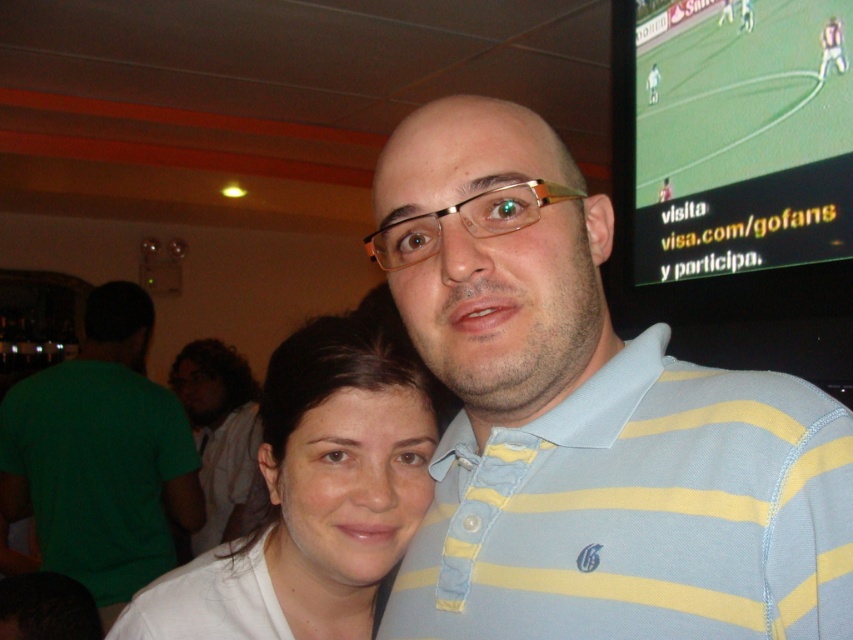
Question: Can you confirm if green cotton shirt at left is wider than light brown hair at center?

Choices:
 (A) no
 (B) yes

Answer: (B)

Question: Estimate the real-world distances between objects in this image. Which object is closer to the light blue striped polo shirt at center?

Choices:
 (A) white fabric shirt at center
 (B) light brown hair at center
 (C) green cotton shirt at left

Answer: (A)

Question: Which object appears farthest from the camera in this image?

Choices:
 (A) white fabric shirt at center
 (B) light blue striped polo shirt at center

Answer: (A)

Question: Can you confirm if light blue striped polo shirt at center is thinner than light brown hair at center?

Choices:
 (A) no
 (B) yes

Answer: (B)

Question: Based on their relative distances, which object is nearer to the light brown hair at center?

Choices:
 (A) white fabric shirt at center
 (B) light blue striped polo shirt at center
 (C) green cotton shirt at left

Answer: (C)

Question: Observing the image, what is the correct spatial positioning of light blue striped polo shirt at center in reference to white fabric shirt at center?

Choices:
 (A) right
 (B) left

Answer: (A)